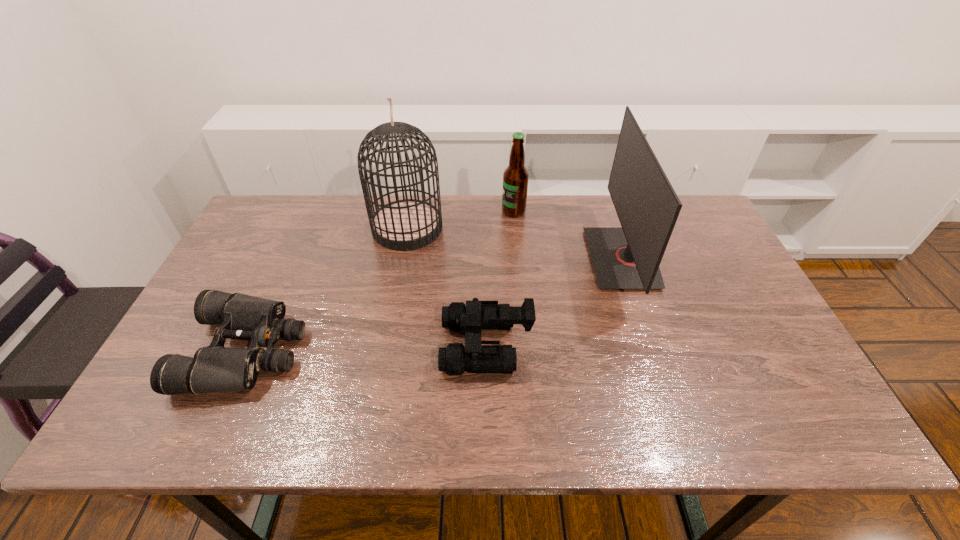
The height and width of the screenshot is (540, 960). What are the coordinates of `birdcage` in the screenshot? It's located at (402, 225).

Find the location of `monitor`. monitor is located at coordinates (628, 257).

The image size is (960, 540). In order to click on the rightmost object in this screenshot , I will do `click(628, 257)`.

This screenshot has height=540, width=960. What are the coordinates of `the third tallest object` in the screenshot? It's located at (515, 177).

Find the location of a particular element. the taller binoculars is located at coordinates (470, 319).

The width and height of the screenshot is (960, 540). Find the location of `the right binoculars`. the right binoculars is located at coordinates click(470, 319).

I want to click on the leftmost object, so click(x=215, y=368).

This screenshot has height=540, width=960. In order to click on the shortest object in this screenshot , I will do `click(215, 368)`.

I want to click on vacant space located on the front of the fourth object from right to left, so click(385, 349).

What are the coordinates of `vacant position located on the screen side of the rightmost object` in the screenshot? It's located at (502, 259).